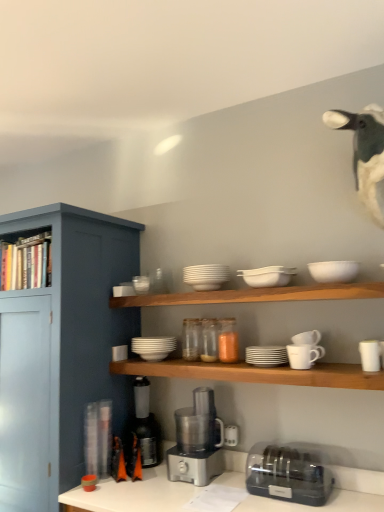
The height and width of the screenshot is (512, 384). What are the coordinates of `vacant area situated below white matte bowls at center, acting as the 1th tableware starting from the left (from a real-world perspective)` in the screenshot? It's located at (148, 358).